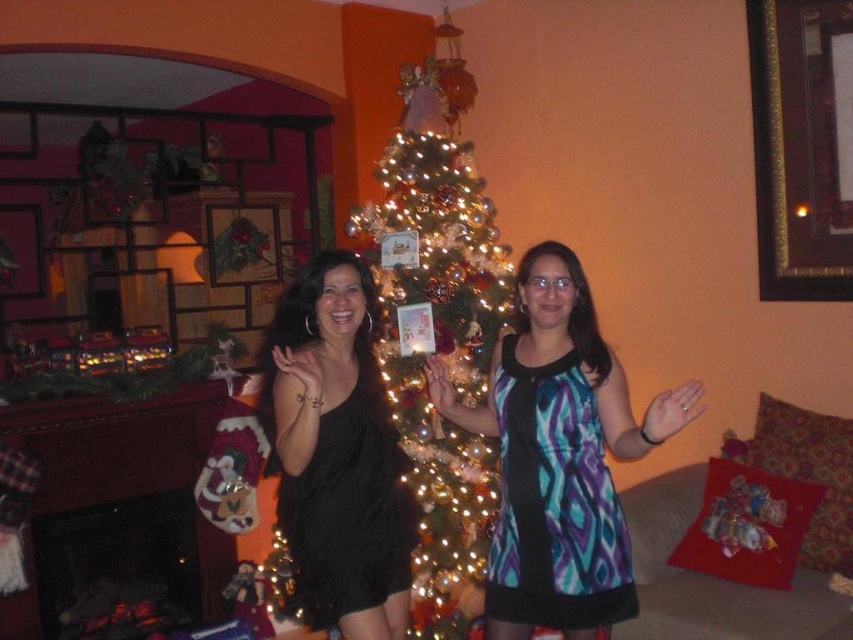
Question: Where is blue and white patterned dress at center located in relation to iridescent glass christmas tree at center in the image?

Choices:
 (A) left
 (B) right

Answer: (B)

Question: From the image, what is the correct spatial relationship of blue and white patterned dress at center in relation to black satin dress at center?

Choices:
 (A) above
 (B) below

Answer: (A)

Question: Which object is positioned farthest from the black satin dress at center?

Choices:
 (A) iridescent glass christmas tree at center
 (B) blue and white patterned dress at center

Answer: (A)

Question: Which point is closer to the camera taking this photo?

Choices:
 (A) (596, 451)
 (B) (325, 436)

Answer: (A)

Question: Which is nearer to the blue and white patterned dress at center?

Choices:
 (A) black satin dress at center
 (B) iridescent glass christmas tree at center

Answer: (A)

Question: Does blue and white patterned dress at center appear under black satin dress at center?

Choices:
 (A) yes
 (B) no

Answer: (B)